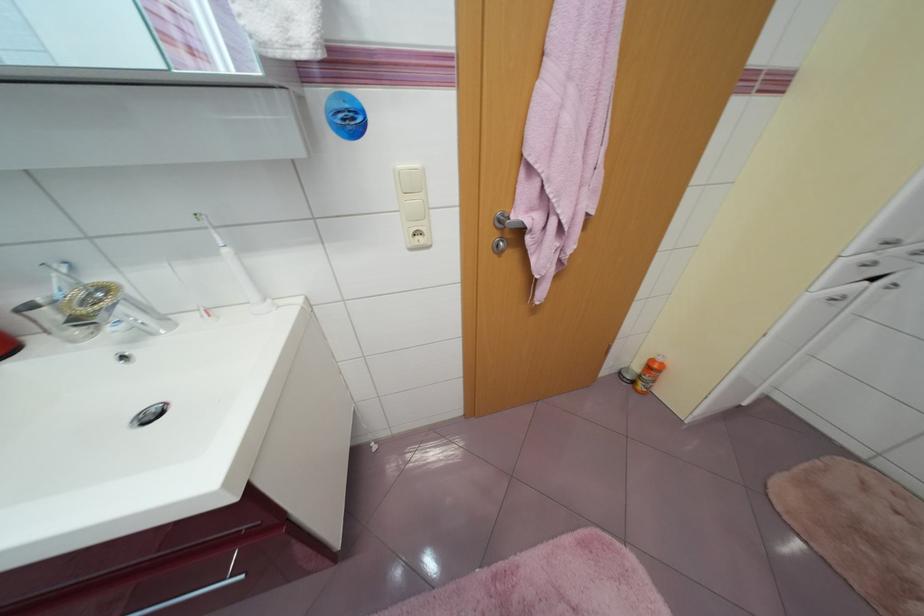
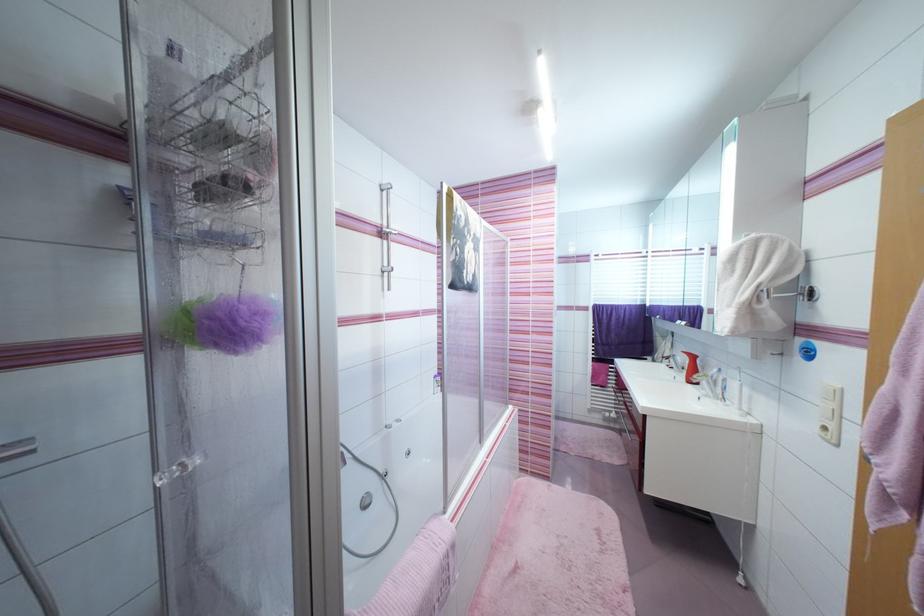
In the second image, find the point that corresponds to pixel 139 342 in the first image.

(711, 398)